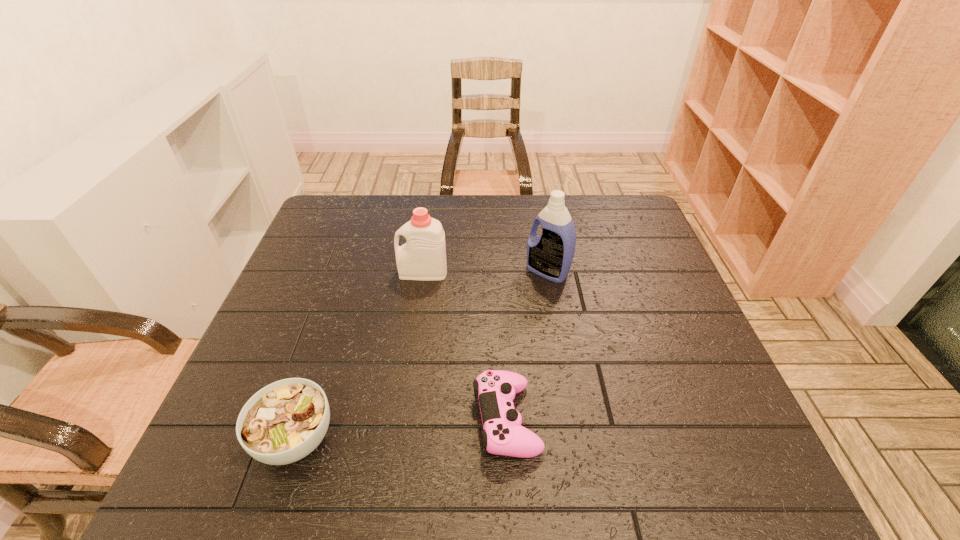
Locate an element on the screen. vacant point at the left edge is located at coordinates (275, 348).

You are a GUI agent. You are given a task and a screenshot of the screen. Output one action in this format:
    pyautogui.click(x=<x>, y=<y>)
    Task: Click on the free spot at the near left corner of the desktop
    This screenshot has width=960, height=540.
    Given the screenshot: What is the action you would take?
    pyautogui.click(x=239, y=458)

The image size is (960, 540). Identify the location of free spot at the far right corner of the desktop. (607, 204).

In the image, there is a desktop. Where is `free space at the near right corner`? This screenshot has width=960, height=540. free space at the near right corner is located at coordinates (749, 457).

Image resolution: width=960 pixels, height=540 pixels. What are the coordinates of `free spot between the third object from left to right and the third tallest object` in the screenshot? It's located at (401, 429).

The height and width of the screenshot is (540, 960). I want to click on free space that is in between the leftmost object and the third object from right to left, so click(x=359, y=355).

This screenshot has height=540, width=960. I want to click on free space between the shortest object and the leftmost object, so click(401, 429).

The width and height of the screenshot is (960, 540). I want to click on free area in between the shorter detergent and the third object from left to right, so click(x=465, y=346).

Where is `free space between the soup bowl and the right detergent`? This screenshot has height=540, width=960. free space between the soup bowl and the right detergent is located at coordinates (421, 355).

Find the location of a particular element. empty space between the left detergent and the taller detergent is located at coordinates (486, 272).